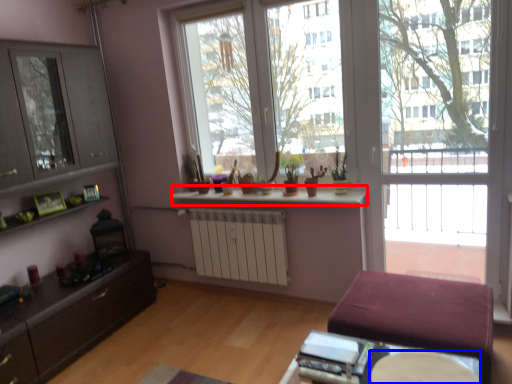
Question: Which of the following is the closest to the observer, window sill (highlighted by a red box) or round table (highlighted by a blue box)?

Choices:
 (A) window sill
 (B) round table

Answer: (B)